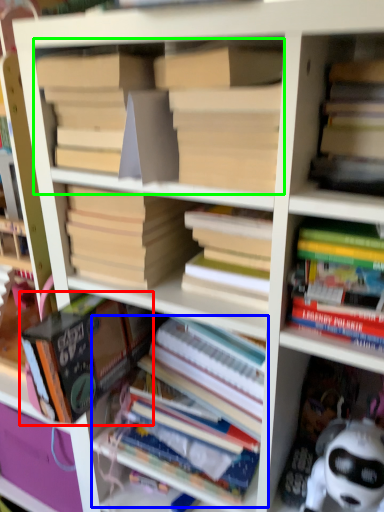
Question: Which is farther away from book (highlighted by a red box)? book (highlighted by a blue box) or book (highlighted by a green box)?

Choices:
 (A) book
 (B) book

Answer: (B)